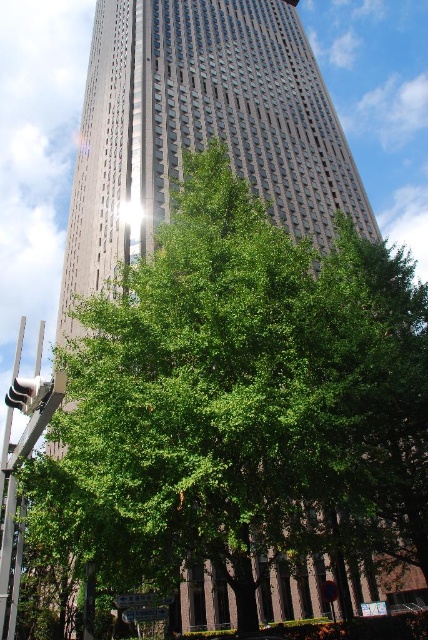
Question: Which point is closer to the camera?

Choices:
 (A) (8, 436)
 (B) (128, 618)
 (C) (157, 595)

Answer: (A)

Question: Which of the following is the farthest from the observer?

Choices:
 (A) metallic street sign at center
 (B) metallic gray pole at lower left
 (C) green plastic street sign at center

Answer: (C)

Question: Which of these objects is positioned farthest from the green plastic street sign at center?

Choices:
 (A) metallic gray pole at lower left
 (B) metallic street sign at center

Answer: (A)

Question: Considering the relative positions of metallic gray pole at lower left and metallic street sign at center in the image provided, where is metallic gray pole at lower left located with respect to metallic street sign at center?

Choices:
 (A) below
 (B) above

Answer: (B)

Question: Is the position of metallic street sign at center less distant than that of green plastic street sign at center?

Choices:
 (A) yes
 (B) no

Answer: (A)

Question: Does metallic street sign at center appear over green plastic street sign at center?

Choices:
 (A) no
 (B) yes

Answer: (B)